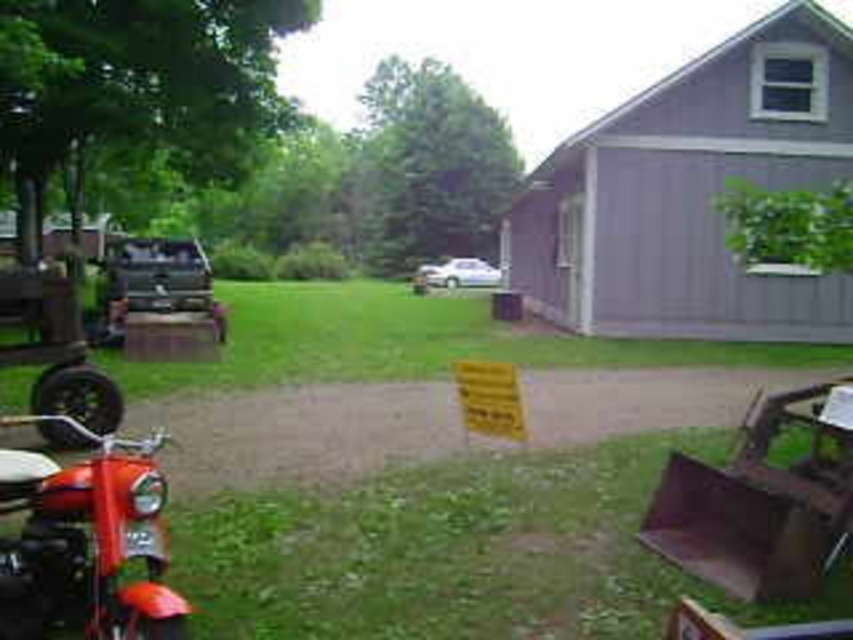
Question: Considering the real-world distances, which object is closest to the shiny red motorcycle at lower left?

Choices:
 (A) smooth concrete driveway at center
 (B) purple woodshed at upper right

Answer: (A)

Question: Is smooth concrete driveway at center to the left of shiny red motorcycle at lower left from the viewer's perspective?

Choices:
 (A) yes
 (B) no

Answer: (B)

Question: Is the position of purple woodshed at upper right less distant than that of smooth concrete driveway at center?

Choices:
 (A) no
 (B) yes

Answer: (A)

Question: Is smooth concrete driveway at center bigger than shiny red motorcycle at lower left?

Choices:
 (A) no
 (B) yes

Answer: (A)

Question: Among these points, which one is nearest to the camera?

Choices:
 (A) (717, 224)
 (B) (695, 406)

Answer: (B)

Question: Which of the following is the farthest from the observer?

Choices:
 (A) shiny red motorcycle at lower left
 (B) purple woodshed at upper right

Answer: (B)